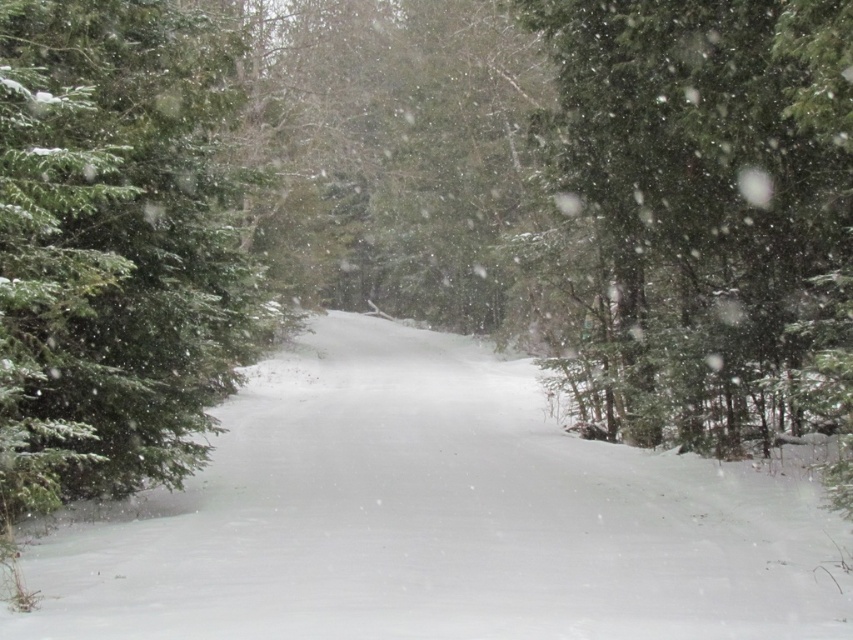
Question: Which of the following is the farthest from the observer?

Choices:
 (A) green matte tree at right
 (B) green matte evergreen tree at left
 (C) white fluffy snow at center

Answer: (A)

Question: Is white fluffy snow at center smaller than green matte tree at right?

Choices:
 (A) no
 (B) yes

Answer: (B)

Question: Can you confirm if white fluffy snow at center is wider than green matte tree at right?

Choices:
 (A) no
 (B) yes

Answer: (B)

Question: Among these points, which one is nearest to the camera?

Choices:
 (A) (827, 129)
 (B) (86, 196)
 (C) (729, 476)

Answer: (B)

Question: Is green matte evergreen tree at left below green matte tree at right?

Choices:
 (A) no
 (B) yes

Answer: (A)

Question: Which point is farther to the camera?

Choices:
 (A) white fluffy snow at center
 (B) green matte tree at right

Answer: (B)